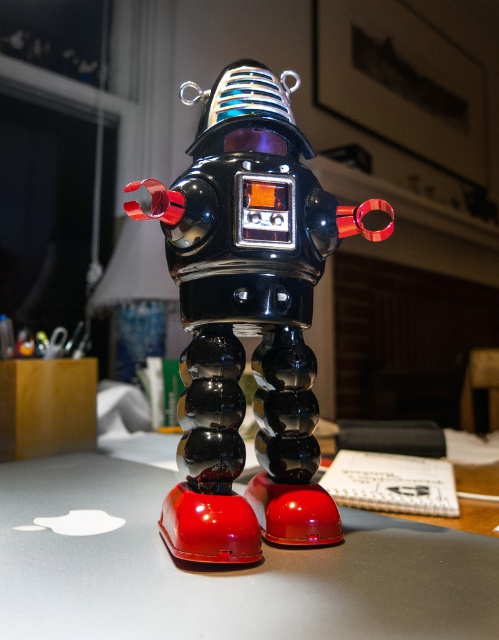
Question: Can you confirm if glossy plastic robot at center is positioned below glossy metallic table at center?

Choices:
 (A) no
 (B) yes

Answer: (A)

Question: Does glossy plastic robot at center have a greater width compared to glossy metallic table at center?

Choices:
 (A) yes
 (B) no

Answer: (B)

Question: Which of the following is the closest to the observer?

Choices:
 (A) glossy plastic robot at center
 (B) glossy metallic table at center

Answer: (B)

Question: Which object appears closest to the camera in this image?

Choices:
 (A) glossy plastic robot at center
 (B) glossy metallic table at center

Answer: (B)

Question: Is glossy plastic robot at center behind glossy metallic table at center?

Choices:
 (A) no
 (B) yes

Answer: (B)